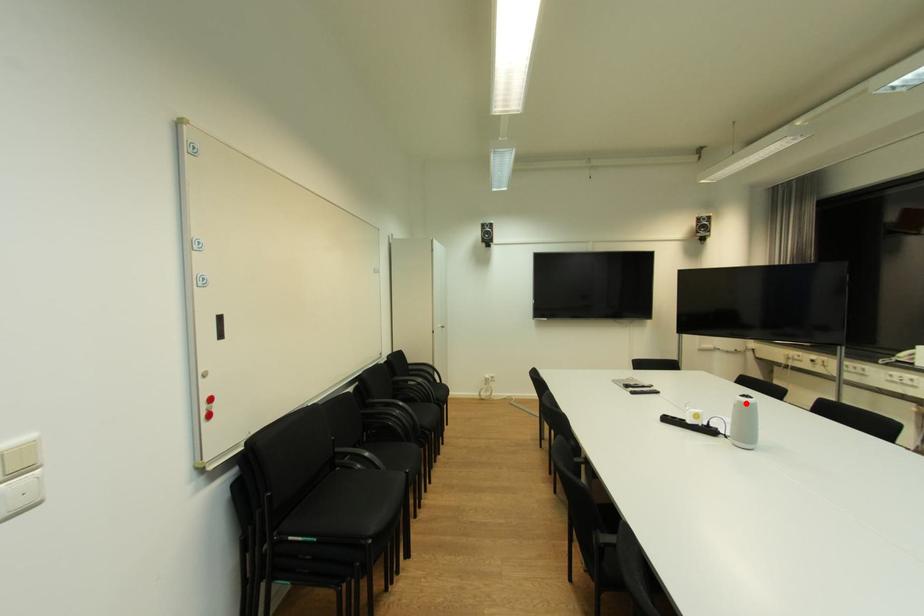
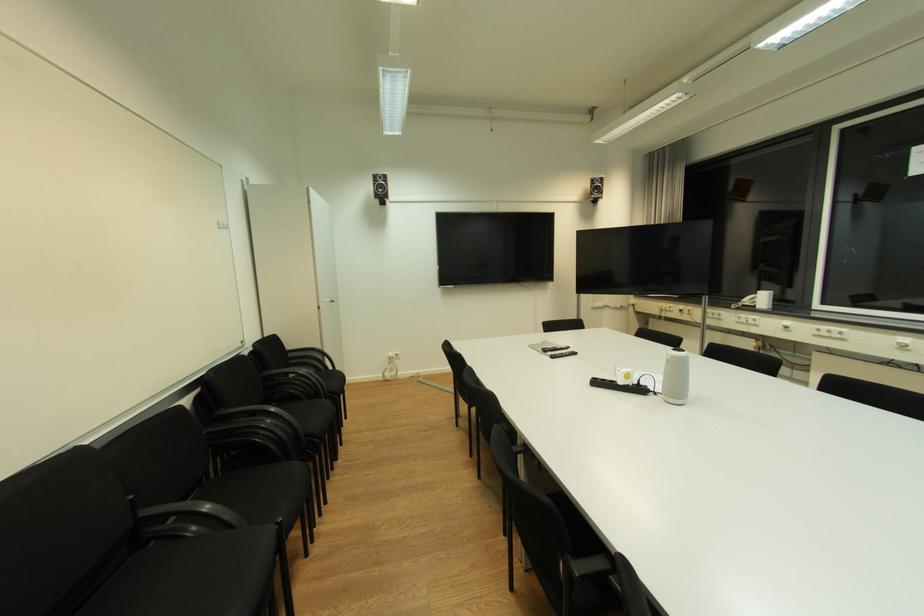
In the second image, find the point that corresponds to the highlighted location in the first image.

(678, 358)